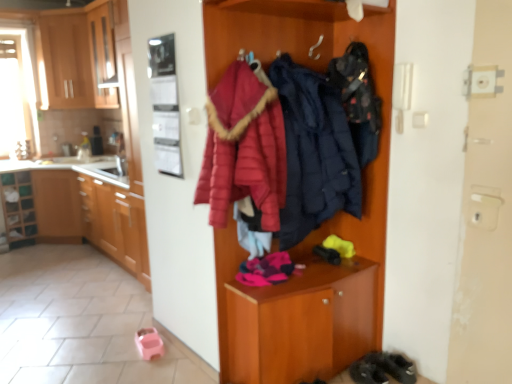
Question: From a real-world perspective, is wooden cabinets at left, marked as the second cabinetry in a top-to-bottom arrangement, physically above wooden cabinet at center?

Choices:
 (A) yes
 (B) no

Answer: (B)

Question: Considering the relative sizes of wooden cabinets at left, which is the second cabinetry in bottom-to-top order, and wooden cabinet at center in the image provided, is wooden cabinets at left, which is the second cabinetry in bottom-to-top order, wider than wooden cabinet at center?

Choices:
 (A) yes
 (B) no

Answer: (A)

Question: Is wooden cabinets at left, marked as the second cabinetry in a top-to-bottom arrangement, next to wooden cabinet at center?

Choices:
 (A) no
 (B) yes

Answer: (A)

Question: Is wooden cabinets at left, which is the second cabinetry in bottom-to-top order, further to the viewer compared to wooden cabinet at center?

Choices:
 (A) no
 (B) yes

Answer: (B)

Question: Is wooden cabinet at upper left, the third cabinetry from the bottom, wider or thinner than wooden cabinet at center?

Choices:
 (A) wide
 (B) thin

Answer: (A)

Question: Would you say wooden cabinet at upper left, acting as the 1th cabinetry starting from the top, is to the left or to the right of wooden cabinet at center in the picture?

Choices:
 (A) right
 (B) left

Answer: (B)

Question: From a real-world perspective, is wooden cabinet at upper left, the third cabinetry from the bottom, physically located above or below wooden cabinet at center?

Choices:
 (A) below
 (B) above

Answer: (B)

Question: Which is correct: wooden cabinet at upper left, the third cabinetry from the bottom, is inside wooden cabinet at center, or outside of it?

Choices:
 (A) inside
 (B) outside

Answer: (B)

Question: Considering the positions of wooden cabinets at left, marked as the second cabinetry in a top-to-bottom arrangement, and matte blue puffer jacket at center, which ranks as the 1th clothing in left-to-right order, in the image, is wooden cabinets at left, marked as the second cabinetry in a top-to-bottom arrangement, taller or shorter than matte blue puffer jacket at center, which ranks as the 1th clothing in left-to-right order,?

Choices:
 (A) tall
 (B) short

Answer: (B)

Question: From a real-world perspective, is wooden cabinets at left, marked as the second cabinetry in a top-to-bottom arrangement, above or below matte blue puffer jacket at center, which ranks as the 1th clothing in left-to-right order?

Choices:
 (A) above
 (B) below

Answer: (B)

Question: Based on their sizes in the image, would you say wooden cabinets at left, marked as the second cabinetry in a top-to-bottom arrangement, is bigger or smaller than matte blue puffer jacket at center, marked as the 2th clothing in a right-to-left arrangement?

Choices:
 (A) small
 (B) big

Answer: (B)

Question: Based on their positions, is wooden cabinets at left, marked as the second cabinetry in a top-to-bottom arrangement, located to the left or right of matte blue puffer jacket at center, which ranks as the 1th clothing in left-to-right order?

Choices:
 (A) right
 (B) left

Answer: (B)

Question: Is dark gray suede shoes at lower right to the left or to the right of metallic refrigerator at upper left in the image?

Choices:
 (A) left
 (B) right

Answer: (B)

Question: Considering the positions of dark gray suede shoes at lower right and metallic refrigerator at upper left in the image, is dark gray suede shoes at lower right taller or shorter than metallic refrigerator at upper left?

Choices:
 (A) tall
 (B) short

Answer: (B)